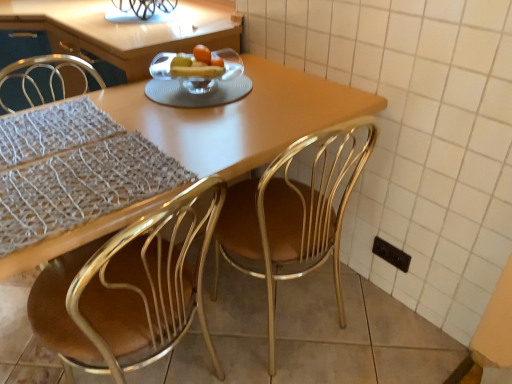
Question: Is matte wooden table at center spatially inside black plastic electric outlet at lower right, or outside of it?

Choices:
 (A) outside
 (B) inside

Answer: (A)

Question: Would you say matte wooden table at center is to the left or to the right of black plastic electric outlet at lower right in the picture?

Choices:
 (A) left
 (B) right

Answer: (A)

Question: Considering the real-world distances, which object is farthest from the clear glass bowl at center?

Choices:
 (A) black plastic electric outlet at lower right
 (B) metallic gold chair at center, the 1th chair in the right-to-left sequence
 (C) gold metallic chair at center, positioned as the 2th chair in right-to-left order
 (D) matte wooden table at center

Answer: (A)

Question: Which object is positioned closest to the clear glass bowl at center?

Choices:
 (A) metallic gold chair at center, which is counted as the 2th chair, starting from the left
 (B) gold metallic chair at center, which is the first chair from left to right
 (C) matte wooden table at center
 (D) black plastic electric outlet at lower right

Answer: (C)